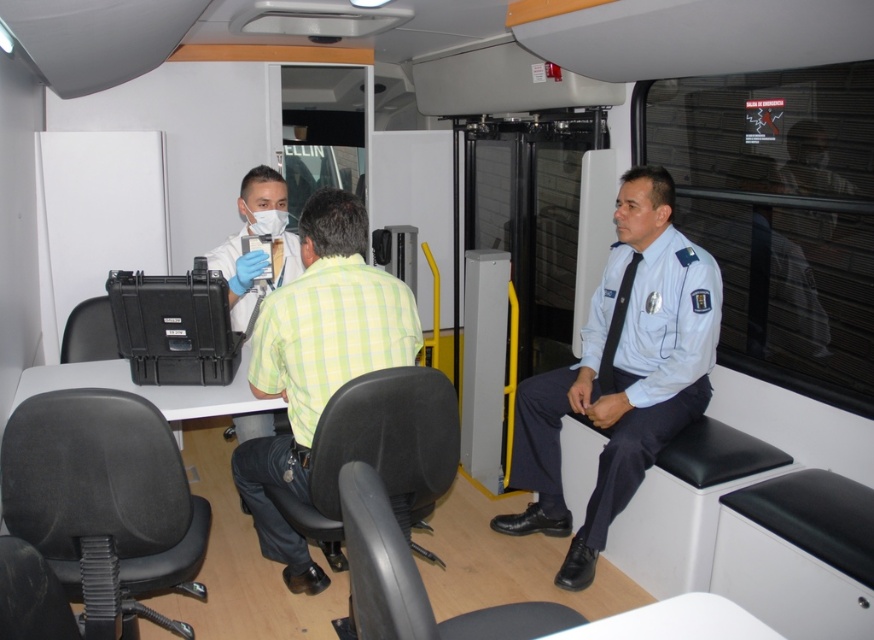
Between black fabric chair at center and black plastic chair at lower center, which one is positioned higher?

Positioned higher is black fabric chair at center.

Is point (406, 429) in front of point (399, 604)?

No, it is not.

Who is more distant from viewer, (420, 520) or (522, 620)?

The point (420, 520) is behind.

This screenshot has width=874, height=640. Identify the location of black fabric chair at center. (379, 452).

Is light green checkered shirt at center smaller than black plastic chair at lower center?

No.

Does light green checkered shirt at center appear over black plastic chair at lower center?

Yes, light green checkered shirt at center is above black plastic chair at lower center.

I want to click on light green checkered shirt at center, so click(317, 362).

At what (x,y) coordinates should I click in order to perform the action: click on light green checkered shirt at center. Please return your answer as a coordinate pair (x, y). Image resolution: width=874 pixels, height=640 pixels. Looking at the image, I should click on (317, 362).

Which of these two, light blue uniform at right or black plastic chair at lower center, stands taller?

With more height is light blue uniform at right.

Does light blue uniform at right appear over black plastic chair at lower center?

Yes, light blue uniform at right is above black plastic chair at lower center.

Which is behind, point (602, 300) or point (410, 570)?

Point (602, 300)

Where is `light blue uniform at right`? The width and height of the screenshot is (874, 640). light blue uniform at right is located at coordinates (621, 372).